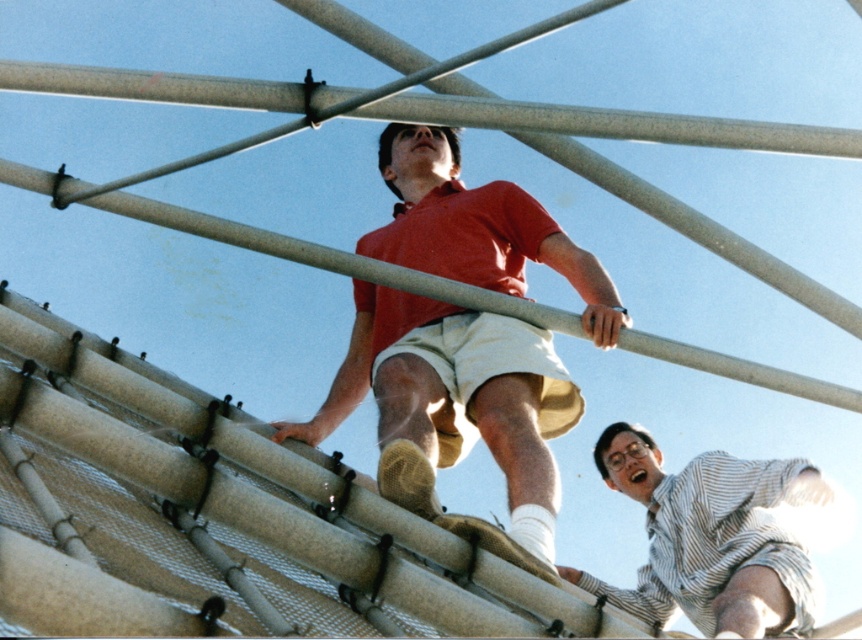
Is point (405, 212) closer to viewer compared to point (686, 502)?

Yes, point (405, 212) is in front of point (686, 502).

Identify the location of matte red shirt at upper center. (453, 403).